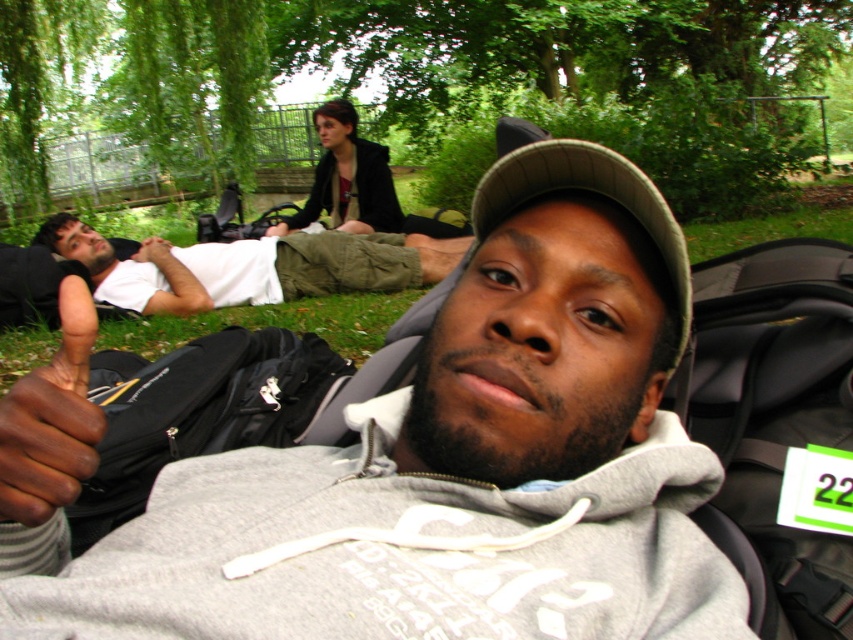
Question: Which of the following is the closest to the observer?

Choices:
 (A) (4, 417)
 (B) (219, 272)

Answer: (A)

Question: Which of the following is the farthest from the observer?

Choices:
 (A) (335, 284)
 (B) (575, 317)

Answer: (A)

Question: Does gray hoodie at center have a smaller size compared to white cotton shirt at left?

Choices:
 (A) yes
 (B) no

Answer: (A)

Question: Can you confirm if gray hoodie at center is positioned below white cotton shirt at left?

Choices:
 (A) no
 (B) yes

Answer: (B)

Question: Is gray hoodie at center to the right of white cotton shirt at left from the viewer's perspective?

Choices:
 (A) no
 (B) yes

Answer: (B)